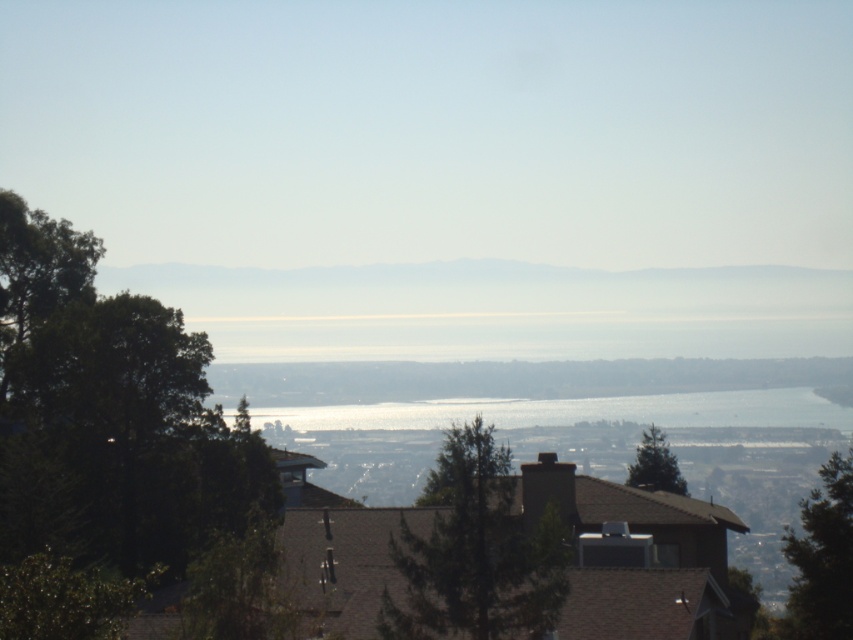
Which is below, green leafy tree at left or translucent glass water at center?

Positioned lower is translucent glass water at center.

Is green leafy tree at left wider than translucent glass water at center?

No, green leafy tree at left is not wider than translucent glass water at center.

At what (x,y) coordinates should I click in order to perform the action: click on green leafy tree at left. Please return your answer as a coordinate pair (x, y). Looking at the image, I should click on (109, 417).

Between translucent glass water at center and green textured tree at right, which one is positioned higher?

green textured tree at right

Does translucent glass water at center have a greater width compared to green textured tree at right?

Indeed, translucent glass water at center has a greater width compared to green textured tree at right.

Where is `translucent glass water at center`? translucent glass water at center is located at coordinates (570, 412).

Can you confirm if green leafy tree at left is wider than clear water at center?

No.

Can you confirm if green leafy tree at left is positioned below clear water at center?

Actually, green leafy tree at left is above clear water at center.

Find the location of a particular element. The image size is (853, 640). green leafy tree at left is located at coordinates (109, 417).